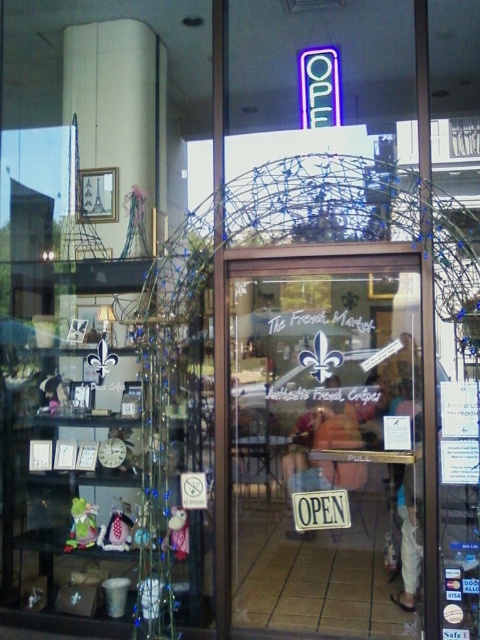
Question: Is transparent glass door at center to the right of matte plastic bag at center from the viewer's perspective?

Choices:
 (A) yes
 (B) no

Answer: (A)

Question: Which of the following is the farthest from the observer?

Choices:
 (A) (264, 513)
 (B) (308, 538)

Answer: (A)

Question: In this image, where is transparent glass door at center located relative to matte plastic bag at center?

Choices:
 (A) left
 (B) right

Answer: (B)

Question: Among these objects, which one is farthest from the camera?

Choices:
 (A) matte plastic bag at center
 (B) transparent glass door at center

Answer: (A)

Question: Is transparent glass door at center wider than matte plastic bag at center?

Choices:
 (A) yes
 (B) no

Answer: (A)

Question: Among these points, which one is nearest to the camera?

Choices:
 (A) (344, 513)
 (B) (291, 484)

Answer: (A)